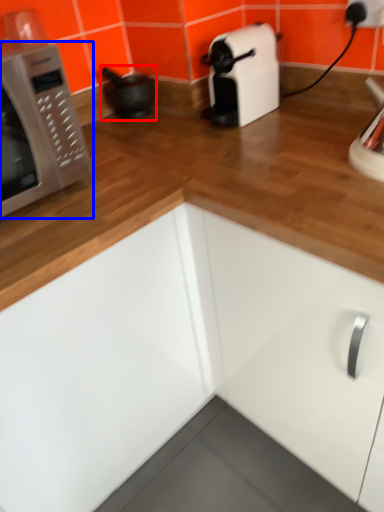
Question: Which point is closer to the camera, appliance (highlighted by a red box) or microwave oven (highlighted by a blue box)?

Choices:
 (A) appliance
 (B) microwave oven

Answer: (B)